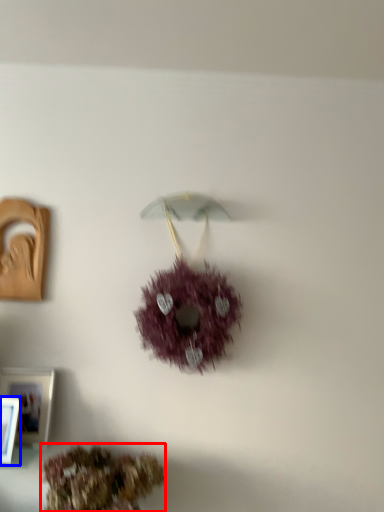
Question: Which object is closer to the camera taking this photo, flower (highlighted by a red box) or picture frame (highlighted by a blue box)?

Choices:
 (A) flower
 (B) picture frame

Answer: (A)